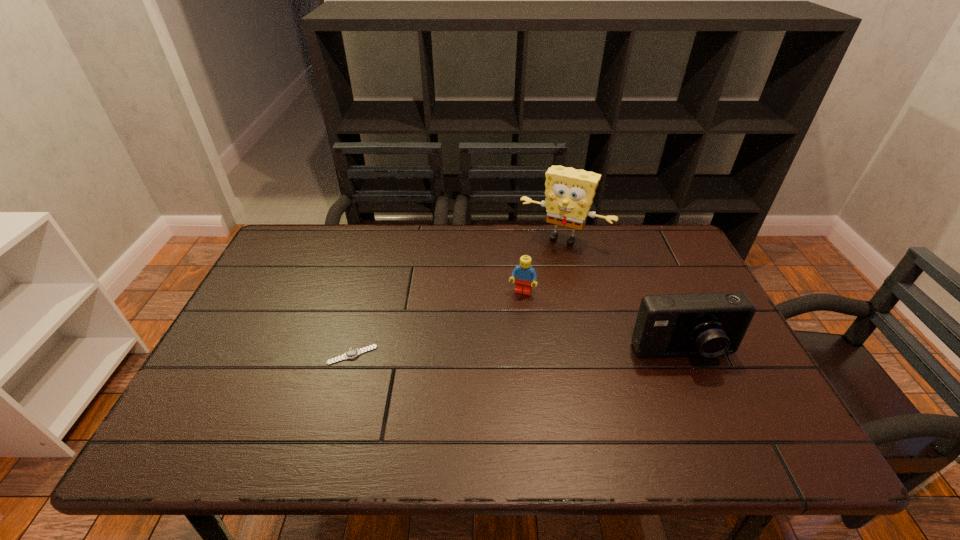
Where is `vacant space at the near left corner of the desktop`? The image size is (960, 540). vacant space at the near left corner of the desktop is located at coordinates (225, 393).

This screenshot has width=960, height=540. Find the location of `vacant space at the far right corner of the desktop`. vacant space at the far right corner of the desktop is located at coordinates (644, 240).

You are a GUI agent. You are given a task and a screenshot of the screen. Output one action in this format:
    pyautogui.click(x=<x>, y=<y>)
    Task: Click on the unoccupied position between the watch and the second shortest object
    This screenshot has height=540, width=960.
    Given the screenshot: What is the action you would take?
    pyautogui.click(x=437, y=323)

Identify the location of vacant area that lies between the farthest object and the Lego. The height and width of the screenshot is (540, 960). (542, 265).

Identify the location of vacant space in between the third shortest object and the second shortest object. The image size is (960, 540). (603, 323).

Where is `free space between the third nearest object and the farthest object`? This screenshot has height=540, width=960. free space between the third nearest object and the farthest object is located at coordinates (542, 265).

What are the coordinates of `vacant space that's between the third shortest object and the shortest object` in the screenshot? It's located at point(517,354).

Locate an element on the screen. free space between the second tallest object and the watch is located at coordinates (517, 354).

Where is `free space that is in between the watch and the third shortest object`? free space that is in between the watch and the third shortest object is located at coordinates (517, 354).

I want to click on free space between the camera and the third tallest object, so click(x=603, y=323).